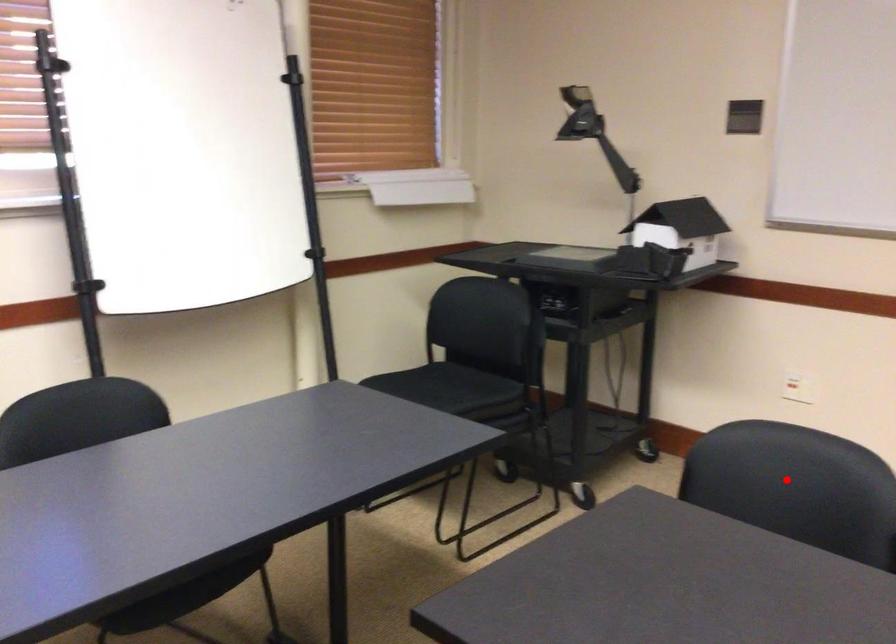
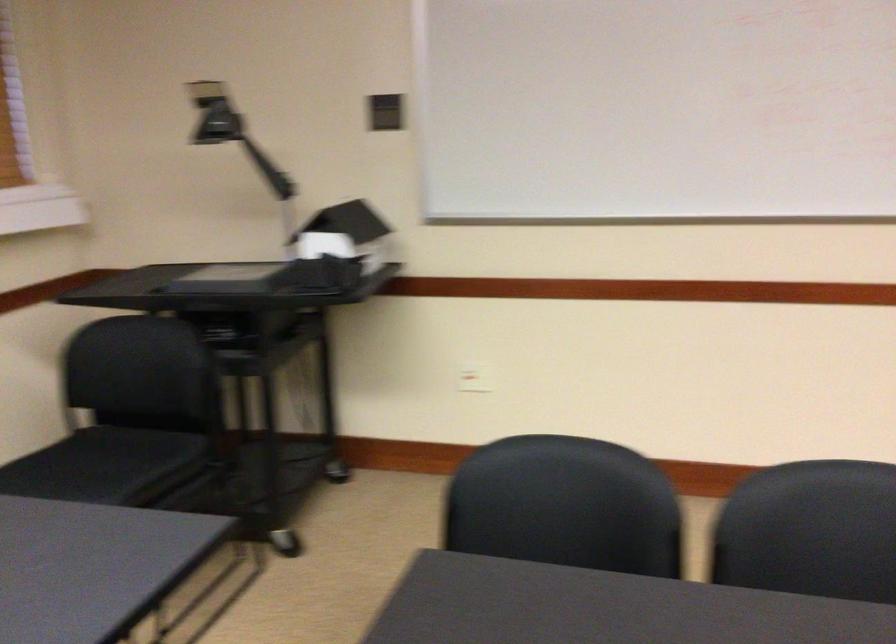
In the second image, find the point that corresponds to the highlighted location in the first image.

(561, 494)